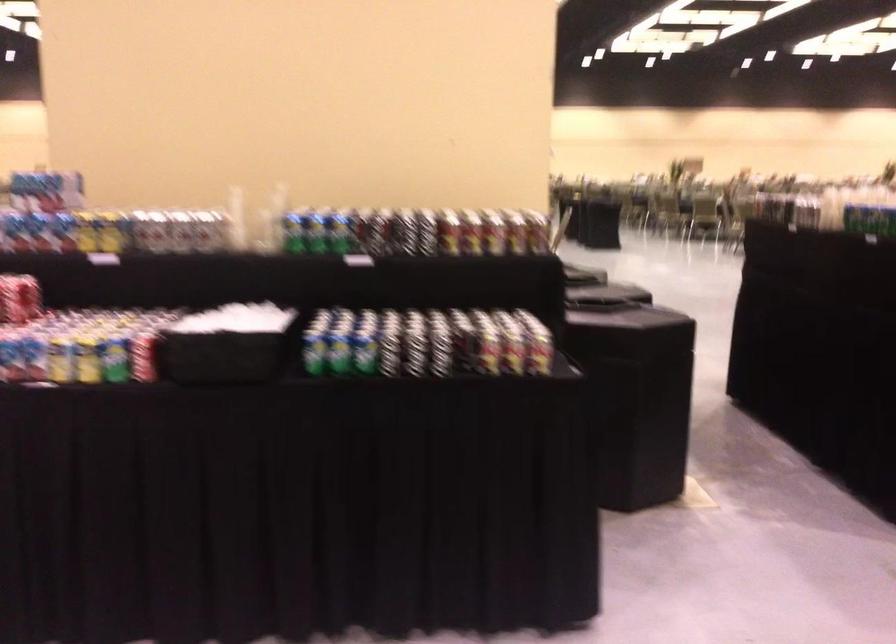
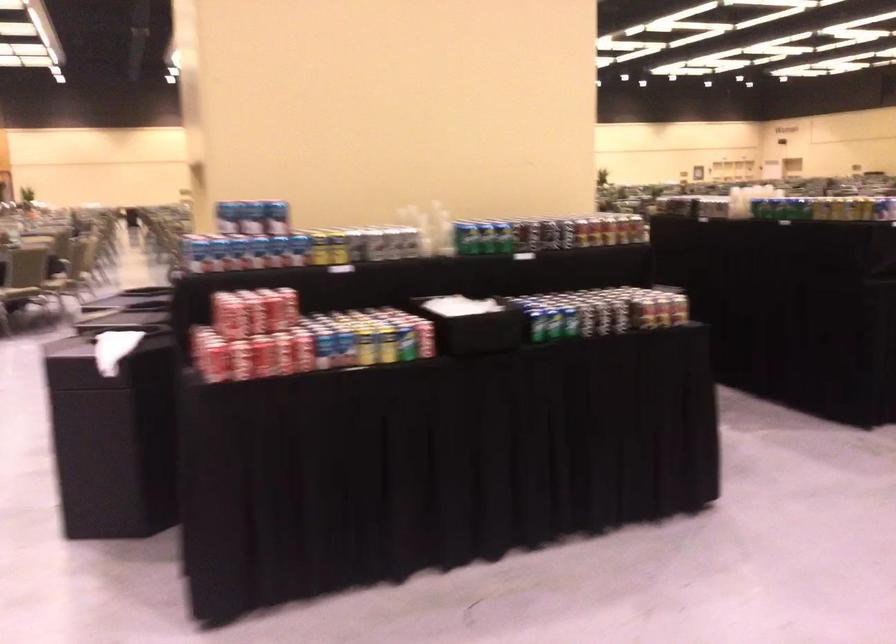
In the second image, find the point that corresponds to point (157, 231) in the first image.

(375, 243)